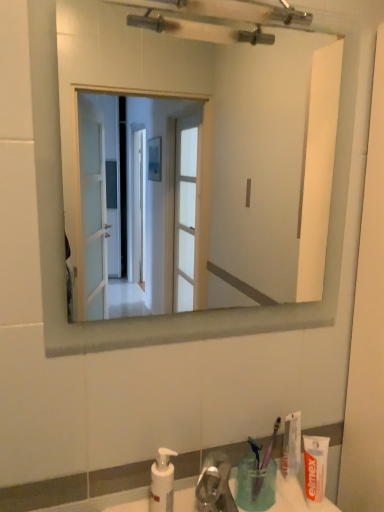
Question: From the image's perspective, would you say translucent plastic cup at lower right is positioned over purple plastic toothbrush at lower right, which appears as the 1th toothbrush when viewed from the right?

Choices:
 (A) no
 (B) yes

Answer: (A)

Question: Considering the relative positions of translucent plastic cup at lower right and purple plastic toothbrush at lower right, which appears as the 1th toothbrush when viewed from the right, in the image provided, is translucent plastic cup at lower right to the left of purple plastic toothbrush at lower right, which appears as the 1th toothbrush when viewed from the right, from the viewer's perspective?

Choices:
 (A) no
 (B) yes

Answer: (B)

Question: From a real-world perspective, is translucent plastic cup at lower right under purple plastic toothbrush at lower right, which appears as the 1th toothbrush when viewed from the right?

Choices:
 (A) yes
 (B) no

Answer: (A)

Question: Is translucent plastic cup at lower right surrounding purple plastic toothbrush at lower right, acting as the 2th toothbrush starting from the left?

Choices:
 (A) yes
 (B) no

Answer: (A)

Question: Is translucent plastic cup at lower right smaller than purple plastic toothbrush at lower right, which appears as the 1th toothbrush when viewed from the right?

Choices:
 (A) yes
 (B) no

Answer: (B)

Question: Is white matte toothpaste at lower right, positioned as the 2th toothpaste in front-to-back order, inside or outside of white matte toothpaste at lower right, which appears as the second toothpaste when viewed from the back?

Choices:
 (A) inside
 (B) outside

Answer: (B)

Question: Is white matte toothpaste at lower right, positioned as the 2th toothpaste in front-to-back order, bigger or smaller than white matte toothpaste at lower right, which appears as the second toothpaste when viewed from the back?

Choices:
 (A) small
 (B) big

Answer: (A)

Question: From the image's perspective, relative to white matte toothpaste at lower right, which appears as the second toothpaste when viewed from the back, is white matte toothpaste at lower right, the 1th toothpaste viewed from the back, above or below?

Choices:
 (A) above
 (B) below

Answer: (A)

Question: Is point (296, 458) positioned closer to the camera than point (306, 443)?

Choices:
 (A) farther
 (B) closer

Answer: (A)

Question: Based on their positions, is white plastic soap dispenser at lower center located to the left or right of blue plastic toothbrush at lower center, the 1th toothbrush from the left?

Choices:
 (A) left
 (B) right

Answer: (A)

Question: In the image, is white plastic soap dispenser at lower center positioned in front of or behind blue plastic toothbrush at lower center, which appears as the second toothbrush when viewed from the right?

Choices:
 (A) behind
 (B) front

Answer: (B)

Question: From the image's perspective, is white plastic soap dispenser at lower center positioned above or below blue plastic toothbrush at lower center, the 1th toothbrush from the left?

Choices:
 (A) above
 (B) below

Answer: (B)

Question: Is point (165, 488) positioned closer to the camera than point (251, 439)?

Choices:
 (A) farther
 (B) closer

Answer: (B)

Question: Would you say white glossy mirror at upper center is inside or outside blue plastic toothbrush at lower center, the 1th toothbrush from the left?

Choices:
 (A) outside
 (B) inside

Answer: (A)

Question: Is point (72, 117) closer or farther from the camera than point (258, 442)?

Choices:
 (A) closer
 (B) farther

Answer: (A)